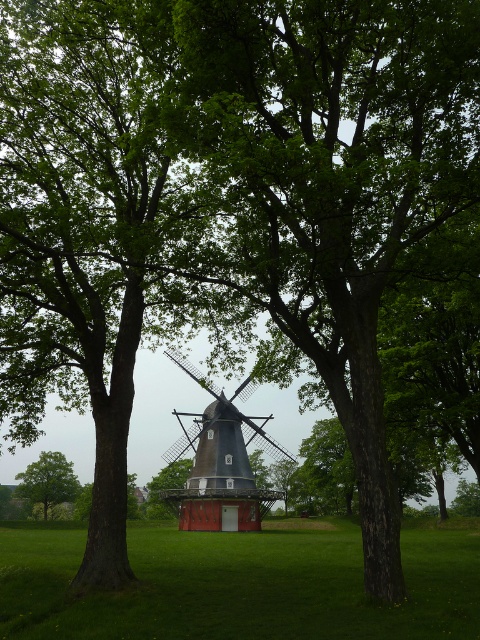
Question: Based on their relative distances, which object is farther from the green grass at center?

Choices:
 (A) green leafy tree at center
 (B) dark brown wooden windmill at center

Answer: (A)

Question: Which of the following is the closest to the observer?

Choices:
 (A) dark brown wooden windmill at center
 (B) green grass at center
 (C) green leafy tree at center

Answer: (B)

Question: Is green grass at center positioned in front of green leafy tree at center?

Choices:
 (A) yes
 (B) no

Answer: (A)

Question: Does green grass at center appear over green leafy tree at center?

Choices:
 (A) yes
 (B) no

Answer: (A)

Question: Which point is farther from the camera taking this photo?

Choices:
 (A) (285, 452)
 (B) (458, 586)

Answer: (A)

Question: Can you confirm if dark brown wooden windmill at center is bigger than green leafy tree at center?

Choices:
 (A) yes
 (B) no

Answer: (A)